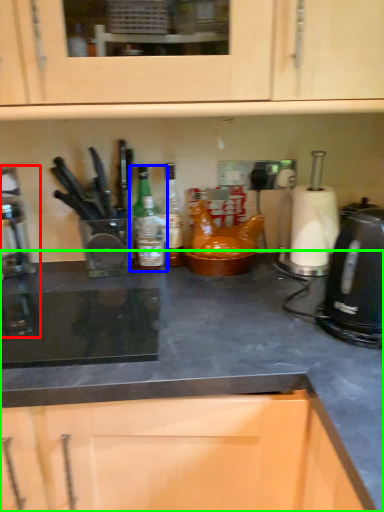
Question: Which object is positioned closest to coffee machine (highlighted by a red box)? Select from kitchen appliance (highlighted by a blue box) and countertop (highlighted by a green box).

Choices:
 (A) kitchen appliance
 (B) countertop

Answer: (A)